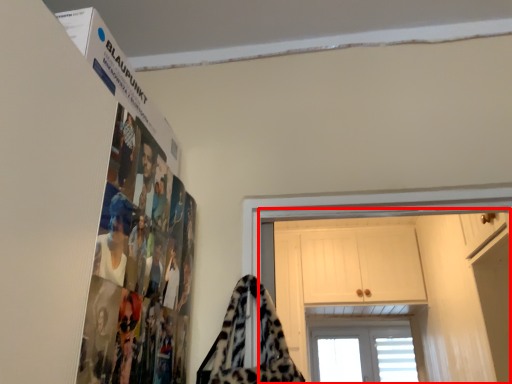
Question: From the image's perspective, what is the correct spatial relationship of dresser (annotated by the red box) in relation to blanket?

Choices:
 (A) below
 (B) above

Answer: (A)